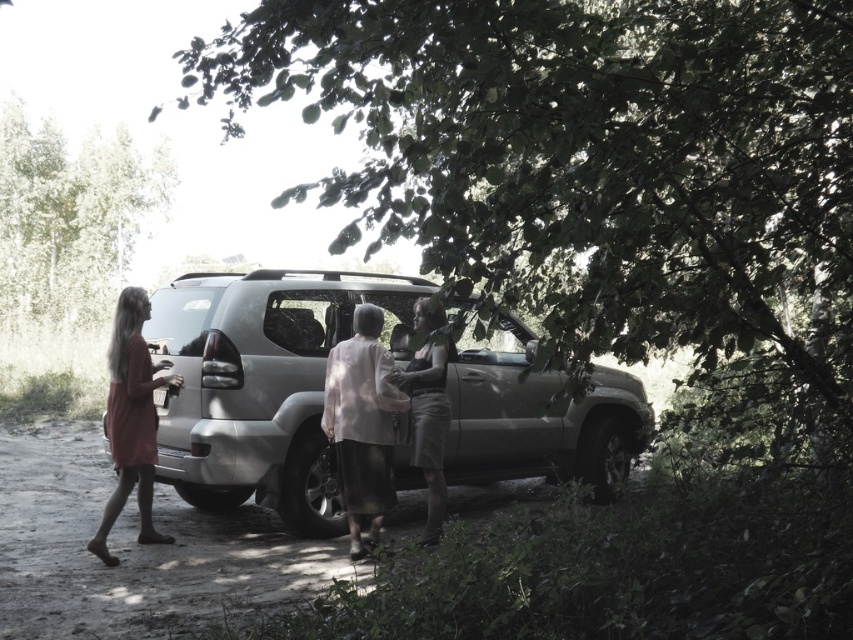
In the scene shown: You are standing on the dirt path and want to take a photo of the satin silver jeep at center without the green leafy tree at center blocking the view. Which direction should you move to get a clear shot?

Move to the right side of the satin silver jeep at center so that the green leafy tree at center is no longer blocking the view, since the tree is to the left of the jeep.

You are standing on the dirt path and want to take a photo of the satin silver jeep at center without the green leafy tree at center blocking it. How should you position yourself?

Move to a position where the green leafy tree at center is no longer between you and the satin silver jeep at center. Since the green leafy tree at center is in front of the satin silver jeep at center, you should move around to the side or behind the tree to get an unobstructed view of the satin silver jeep at center.